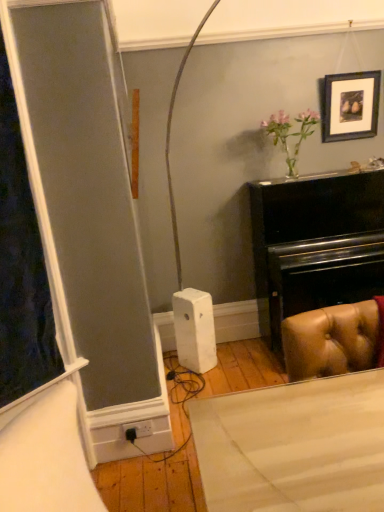
This screenshot has height=512, width=384. I want to click on wooden picture frame at upper right, so click(x=351, y=106).

What do you see at coordinates (351, 106) in the screenshot? I see `wooden picture frame at upper right` at bounding box center [351, 106].

The width and height of the screenshot is (384, 512). What do you see at coordinates (137, 430) in the screenshot?
I see `black plastic plug at lower center` at bounding box center [137, 430].

The image size is (384, 512). In order to click on black plastic plug at lower center in this screenshot , I will do `click(137, 430)`.

I want to click on wooden picture frame at upper right, so click(x=351, y=106).

Looking at this image, between black plastic plug at lower center and wooden picture frame at upper right, which one appears on the right side from the viewer's perspective?

Positioned to the right is wooden picture frame at upper right.

From the picture: Is black plastic plug at lower center positioned in front of wooden picture frame at upper right?

Yes, the depth of black plastic plug at lower center is less than that of wooden picture frame at upper right.

Is point (129, 436) closer or farther from the camera than point (347, 88)?

Point (129, 436) is positioned closer to the camera compared to point (347, 88).

From the image's perspective, is black plastic plug at lower center above wooden picture frame at upper right?

No, from the image's perspective, black plastic plug at lower center is not over wooden picture frame at upper right.

From a real-world perspective, which object rests below the other?

black plastic plug at lower center is physically lower.

Is black plastic plug at lower center wider or thinner than wooden picture frame at upper right?

In the image, black plastic plug at lower center appears to be more narrow than wooden picture frame at upper right.

In terms of height, does black plastic plug at lower center look taller or shorter compared to wooden picture frame at upper right?

In the image, black plastic plug at lower center appears to be shorter than wooden picture frame at upper right.

Can you confirm if black plastic plug at lower center is smaller than wooden picture frame at upper right?

Yes, black plastic plug at lower center is smaller than wooden picture frame at upper right.

Is black plastic plug at lower center spatially inside wooden picture frame at upper right, or outside of it?

black plastic plug at lower center is spatially situated outside wooden picture frame at upper right.

Is black plastic plug at lower center beside wooden picture frame at upper right?

black plastic plug at lower center and wooden picture frame at upper right are not in contact.

Could you tell me if black plastic plug at lower center is turned towards wooden picture frame at upper right?

No, black plastic plug at lower center is not oriented towards wooden picture frame at upper right.

How many degrees apart are the facing directions of black plastic plug at lower center and wooden picture frame at upper right?

The angular difference between black plastic plug at lower center and wooden picture frame at upper right is 1.27 degrees.

Measure the distance from black plastic plug at lower center to wooden picture frame at upper right.

black plastic plug at lower center is 8.03 feet away from wooden picture frame at upper right.

The height and width of the screenshot is (512, 384). Identify the location of picture frame on the right of the black plastic plug at lower center. (351, 106).

Does wooden picture frame at upper right appear on the right side of black plastic plug at lower center?

Indeed, wooden picture frame at upper right is positioned on the right side of black plastic plug at lower center.

Which object is more forward, wooden picture frame at upper right or black plastic plug at lower center?

black plastic plug at lower center is closer to the camera.

Does point (371, 93) lie in front of point (136, 426)?

No, it is behind (136, 426).

From the image's perspective, which is above, wooden picture frame at upper right or black plastic plug at lower center?

wooden picture frame at upper right appears higher in the image.

From a real-world perspective, is wooden picture frame at upper right physically below black plastic plug at lower center?

No, from a real-world perspective, wooden picture frame at upper right is not under black plastic plug at lower center.

Which object is wider, wooden picture frame at upper right or black plastic plug at lower center?

With larger width is wooden picture frame at upper right.

Can you confirm if wooden picture frame at upper right is taller than black plastic plug at lower center?

Yes.

Between wooden picture frame at upper right and black plastic plug at lower center, which one has smaller size?

black plastic plug at lower center.

Is wooden picture frame at upper right outside of black plastic plug at lower center?

wooden picture frame at upper right is positioned outside black plastic plug at lower center.

Can you see wooden picture frame at upper right touching black plastic plug at lower center?

wooden picture frame at upper right and black plastic plug at lower center are clearly separated.

Looking at this image, could you tell me if wooden picture frame at upper right is turned towards black plastic plug at lower center?

No, wooden picture frame at upper right does not turn towards black plastic plug at lower center.

The image size is (384, 512). I want to click on picture frame lying on the right of black plastic plug at lower center, so click(x=351, y=106).

Where is `picture frame located behind the black plastic plug at lower center`? The width and height of the screenshot is (384, 512). picture frame located behind the black plastic plug at lower center is located at coordinates (351, 106).

At what (x,y) coordinates should I click in order to perform the action: click on plug located underneath the wooden picture frame at upper right (from a real-world perspective). Please return your answer as a coordinate pair (x, y). Image resolution: width=384 pixels, height=512 pixels. Looking at the image, I should click on (137, 430).